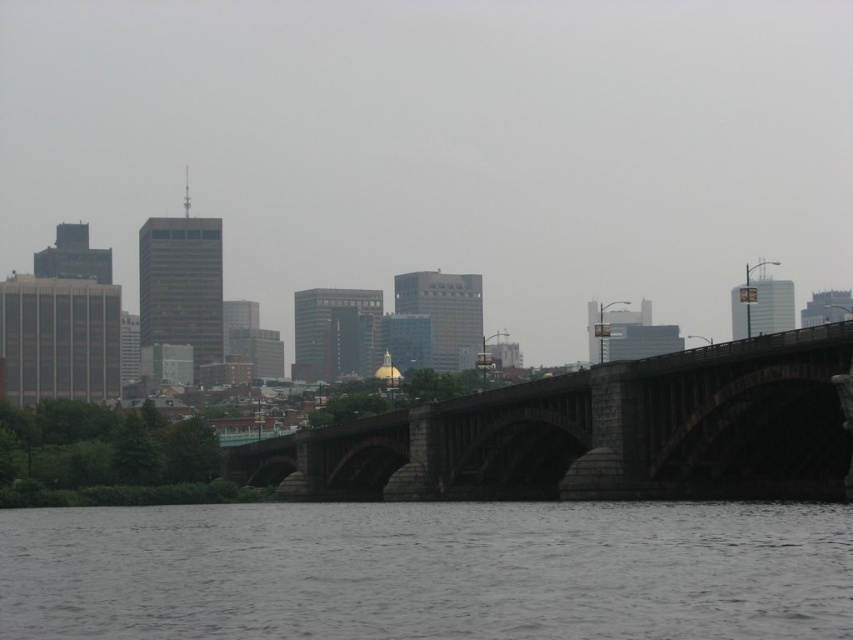
You are a tourist standing on the riverbank and see the gray stone bridge at lower center and the dark gray stone bridge at center. Which bridge is closer to you?

The gray stone bridge at lower center is closer to you because it is positioned in front of the dark gray stone bridge at center.

You are a tourist standing on the riverbank and want to take a photo of the city skyline. You have two bridges in your viewfinder, the gray stone bridge at lower center and the dark gray stone bridge at center. Which bridge should you position to the left side in your photo to capture the golden dome building in the background?

To capture the golden dome building in the background, you should position the gray stone bridge at lower center to the left side in your photo since it is already on the left side of the dark gray stone bridge at center, allowing the golden dome to be framed appropriately in the city skyline behind them.

You are a tourist standing on the riverbank looking at the cityscape. You notice two bridges in the image. Which bridge is closer to you, the gray stone bridge at lower center or the dark gray stone bridge at center?

The gray stone bridge at lower center is closer to you because it is positioned lower in the image, which typically indicates proximity in such scenes.